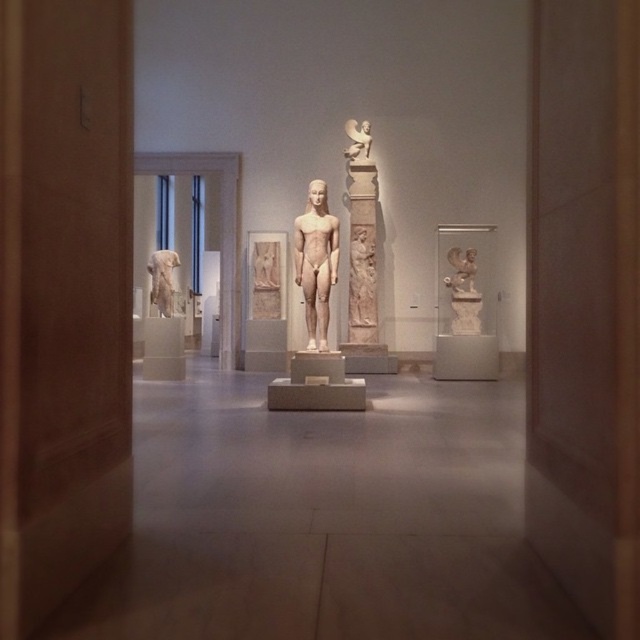
Question: Is white marble statue at left thinner than white marble relief at upper center?

Choices:
 (A) no
 (B) yes

Answer: (A)

Question: Is white marble statue at center wider than white marble statue at left?

Choices:
 (A) no
 (B) yes

Answer: (A)

Question: Which point is closer to the camera?

Choices:
 (A) (330, 225)
 (B) (468, 262)
 (C) (163, 259)
 (D) (369, 124)

Answer: (A)

Question: Estimate the real-world distances between objects in this image. Which object is farther from the white marble statue at center?

Choices:
 (A) white marble relief at upper center
 (B) white marble statue at center-right

Answer: (A)

Question: Which object is farther from the camera taking this photo?

Choices:
 (A) white marble relief at upper center
 (B) white marble statue at center-right

Answer: (A)

Question: Does white marble statue at center-right have a larger size compared to white marble relief at upper center?

Choices:
 (A) yes
 (B) no

Answer: (A)